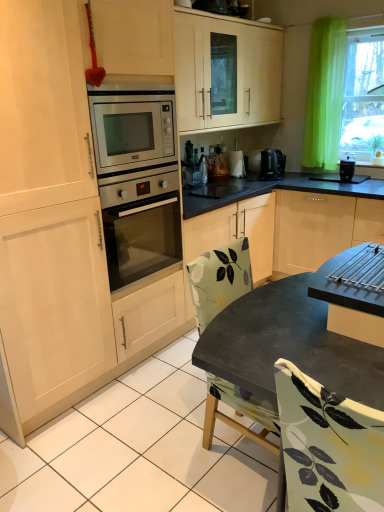
You are a GUI agent. You are given a task and a screenshot of the screen. Output one action in this format:
    pyautogui.click(x=<x>, y=<y>)
    Task: Click on the green sheer curtain at upper right
    Image resolution: width=384 pixels, height=512 pixels.
    Given the screenshot: What is the action you would take?
    pyautogui.click(x=363, y=95)

What do you see at coordinates (265, 336) in the screenshot? I see `matte black table at center` at bounding box center [265, 336].

What do you see at coordinates (141, 227) in the screenshot? I see `satin silver oven at center` at bounding box center [141, 227].

You are a GUI agent. You are given a task and a screenshot of the screen. Output one action in this format:
    pyautogui.click(x=<x>, y=<y>)
    Task: Click on the satin silver oven at center
    Image resolution: width=384 pixels, height=512 pixels.
    Given the screenshot: What is the action you would take?
    pyautogui.click(x=141, y=227)

Locate an element on the screen. This screenshot has width=384, height=512. green sheer curtain at upper right is located at coordinates (363, 95).

Is metallic silver coffee maker at upper right to the right of black plastic coffee maker at right from the viewer's perspective?

No.

Which object is further away from the camera, metallic silver coffee maker at upper right or black plastic coffee maker at right?

metallic silver coffee maker at upper right is further from the camera.

Is metallic silver coffee maker at upper right facing towards black plastic coffee maker at right?

Yes, metallic silver coffee maker at upper right is aimed at black plastic coffee maker at right.

Which is closer to the camera, (x=275, y=157) or (x=344, y=178)?

Clearly, point (x=275, y=157) is more distant from the camera than point (x=344, y=178).

How far apart are satin silver oven at center and metallic silver coffee maker at upper right?

satin silver oven at center is 5.12 feet from metallic silver coffee maker at upper right.

From a real-world perspective, between satin silver oven at center and metallic silver coffee maker at upper right, who is vertically higher?

metallic silver coffee maker at upper right is physically above.

Can you confirm if satin silver oven at center is shorter than metallic silver coffee maker at upper right?

Incorrect, the height of satin silver oven at center does not fall short of that of metallic silver coffee maker at upper right.

Can we say satin silver oven at center lies outside metallic silver coffee maker at upper right?

That's correct, satin silver oven at center is outside of metallic silver coffee maker at upper right.

Can you tell me how much green sheer curtain at upper right and metallic silver coffee maker at upper right differ in facing direction?

green sheer curtain at upper right and metallic silver coffee maker at upper right are facing 94.2 degrees away from each other.

Which is closer, (369, 161) or (270, 149)?

The point (369, 161) is more forward.

Considering the relative sizes of green sheer curtain at upper right and metallic silver coffee maker at upper right in the image provided, is green sheer curtain at upper right thinner than metallic silver coffee maker at upper right?

No.

From a real-world perspective, is green sheer curtain at upper right physically located above or below metallic silver coffee maker at upper right?

Clearly, from a real-world perspective, green sheer curtain at upper right is above metallic silver coffee maker at upper right.

Does black plastic coffee maker at right lie behind satin silver oven at center?

Yes, black plastic coffee maker at right is further from the camera.

Which is more to the left, black plastic coffee maker at right or satin silver oven at center?

Positioned to the left is satin silver oven at center.

How different are the orientations of black plastic coffee maker at right and satin silver oven at center in degrees?

92.3 degrees.

Considering the sizes of objects black plastic coffee maker at right and metallic silver coffee maker at upper right in the image provided, who is smaller, black plastic coffee maker at right or metallic silver coffee maker at upper right?

With smaller size is black plastic coffee maker at right.

Where is `kitchen appliance on the left of the black plastic coffee maker at right`? This screenshot has height=512, width=384. kitchen appliance on the left of the black plastic coffee maker at right is located at coordinates (272, 164).

Considering the sizes of black plastic coffee maker at right and metallic silver coffee maker at upper right in the image, is black plastic coffee maker at right wider or thinner than metallic silver coffee maker at upper right?

Clearly, black plastic coffee maker at right has less width compared to metallic silver coffee maker at upper right.

Is black plastic coffee maker at right not close to metallic silver coffee maker at upper right?

Actually, black plastic coffee maker at right and metallic silver coffee maker at upper right are a little close together.

Find the location of a particular element. The image size is (384, 512). kitchen appliance located behind the matte black table at center is located at coordinates (272, 164).

Considering the relative sizes of metallic silver coffee maker at upper right and matte black table at center in the image provided, is metallic silver coffee maker at upper right shorter than matte black table at center?

Correct, metallic silver coffee maker at upper right is not as tall as matte black table at center.

From the image's perspective, is metallic silver coffee maker at upper right above or below matte black table at center?

Based on their image positions, metallic silver coffee maker at upper right is located above matte black table at center.

Based on the photo, which is more to the left, metallic silver coffee maker at upper right or matte black table at center?

From the viewer's perspective, matte black table at center appears more on the left side.

Is the depth of satin silver oven at center less than that of black plastic coffee maker at right?

Yes.

Considering the positions of points (169, 223) and (350, 175), is point (169, 223) closer to camera compared to point (350, 175)?

Yes, it is in front of point (350, 175).

Is satin silver oven at center oriented towards black plastic coffee maker at right?

No, satin silver oven at center is not turned towards black plastic coffee maker at right.

Where is `kitchen appliance located behind the black plastic coffee maker at right`? This screenshot has height=512, width=384. kitchen appliance located behind the black plastic coffee maker at right is located at coordinates (272, 164).

Image resolution: width=384 pixels, height=512 pixels. Identify the location of oven that appears on the left of metallic silver coffee maker at upper right. (141, 227).

Which object lies nearer to the anchor point black plastic coffee maker at right, satin silver oven at center or metallic silver coffee maker at upper right?

Based on the image, metallic silver coffee maker at upper right appears to be nearer to black plastic coffee maker at right.

Estimate the real-world distances between objects in this image. Which object is further from matte black table at center, green sheer curtain at upper right or satin silver oven at center?

green sheer curtain at upper right is further to matte black table at center.

When comparing their distances from metallic silver coffee maker at upper right, does black plastic coffee maker at right or satin silver oven at center seem further?

satin silver oven at center is positioned further to the anchor metallic silver coffee maker at upper right.

Which object lies further to the anchor point metallic silver coffee maker at upper right, satin silver oven at center or black plastic coffee maker at right?

Based on the image, satin silver oven at center appears to be further to metallic silver coffee maker at upper right.

Estimate the real-world distances between objects in this image. Which object is further from black plastic coffee maker at right, green sheer curtain at upper right or matte black table at center?

The object further to black plastic coffee maker at right is matte black table at center.

Based on their spatial positions, is metallic silver coffee maker at upper right or satin silver oven at center further from matte black table at center?

The object further to matte black table at center is metallic silver coffee maker at upper right.

Based on their spatial positions, is matte black table at center or black plastic coffee maker at right further from metallic silver coffee maker at upper right?

matte black table at center.

Looking at the image, which one is located closer to green sheer curtain at upper right, matte black table at center or satin silver oven at center?

Among the two, satin silver oven at center is located nearer to green sheer curtain at upper right.

Locate an element on the screen. The image size is (384, 512). kitchen appliance between satin silver oven at center and green sheer curtain at upper right is located at coordinates (272, 164).

At what (x,y) coordinates should I click in order to perform the action: click on appliance situated between satin silver oven at center and green sheer curtain at upper right from left to right. Please return your answer as a coordinate pair (x, y). Looking at the image, I should click on (347, 169).

At what (x,y) coordinates should I click in order to perform the action: click on window between matte black table at center and metallic silver coffee maker at upper right along the z-axis. Please return your answer as a coordinate pair (x, y). The height and width of the screenshot is (512, 384). Looking at the image, I should click on pos(363,95).

This screenshot has height=512, width=384. Identify the location of oven between matte black table at center and metallic silver coffee maker at upper right in the front-back direction. (141, 227).